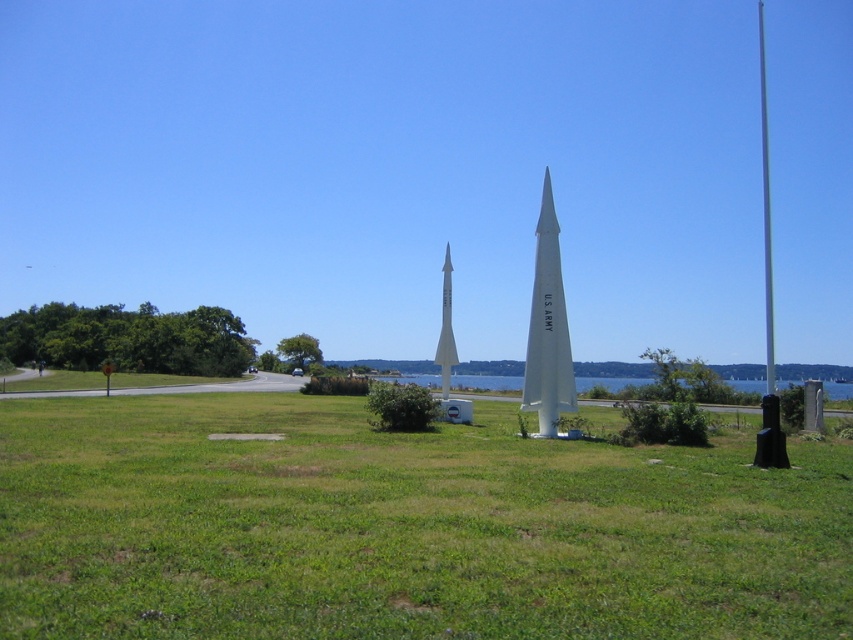
Based on the photo, how distant is green grassy at center from blue water at center?

green grassy at center is 51.69 meters away from blue water at center.

Between green grassy at center and blue water at center, which one is positioned higher?

green grassy at center is above.

The height and width of the screenshot is (640, 853). Identify the location of green grassy at center. (402, 528).

Measure the distance between green grassy at center and white matte us army missile at center.

green grassy at center is 9.67 meters from white matte us army missile at center.

In the scene shown: Who is positioned more to the left, green grassy at center or white matte us army missile at center?

green grassy at center

Who is more forward, (643, 476) or (564, 381)?

Point (643, 476) is more forward.

Locate an element on the screen. This screenshot has width=853, height=640. green grassy at center is located at coordinates coord(402,528).

Who is lower down, white matte us army missile at center or blue water at center?

Positioned lower is blue water at center.

Is white matte us army missile at center taller than blue water at center?

Yes, white matte us army missile at center is taller than blue water at center.

Find the location of a particular element. white matte us army missile at center is located at coordinates (547, 326).

Where is `white matte us army missile at center`? Image resolution: width=853 pixels, height=640 pixels. white matte us army missile at center is located at coordinates (547, 326).